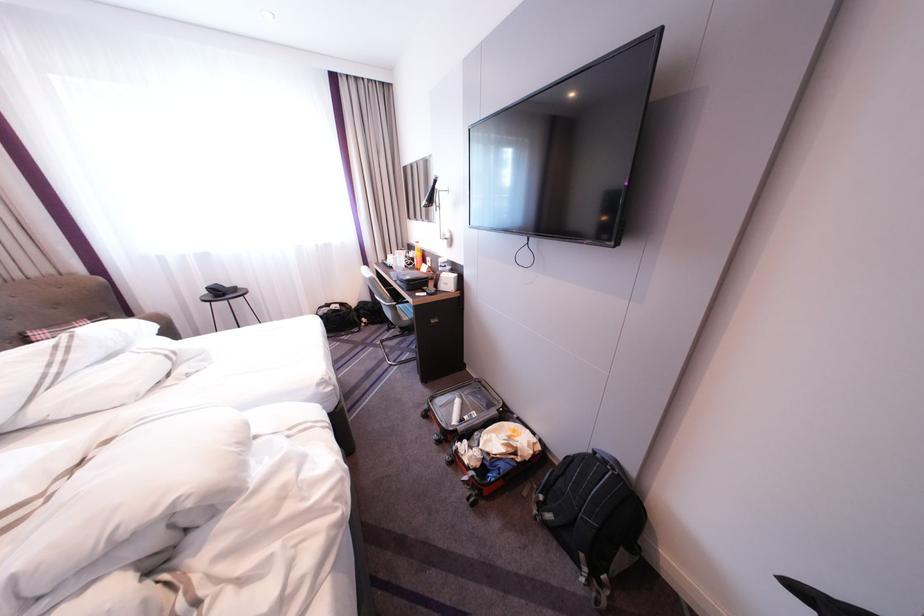
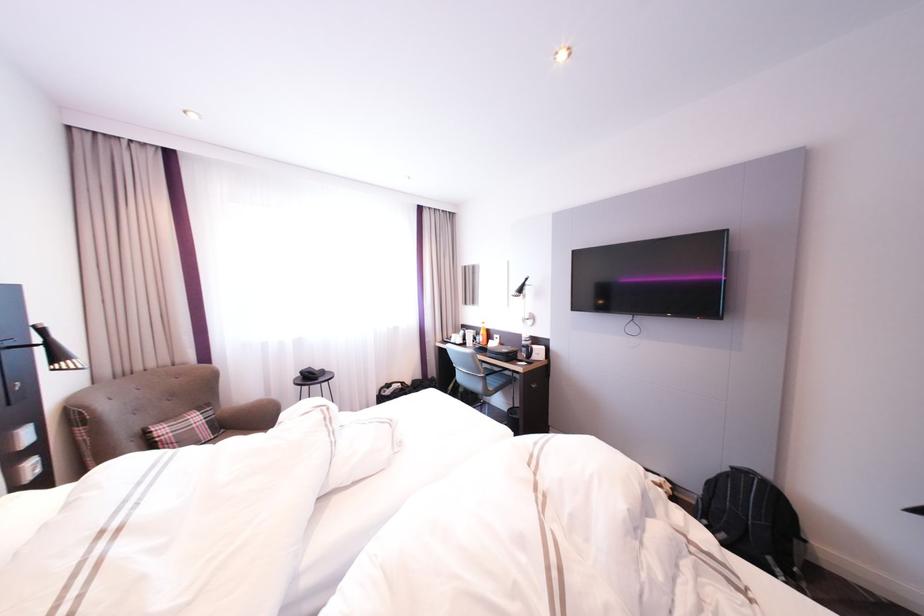
Question: Which direction would the cameraman need to move to produce the second image? Reply with the corresponding letter.

Choices:
 (A) Left
 (B) Right
 (C) Forward
 (D) Backward

Answer: (A)